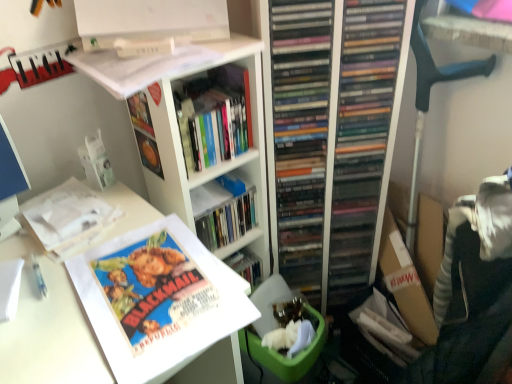
Question: Considering the relative sizes of white matte bookshelf at upper center and white paper at upper left, which appears as the 2th book when ordered from the bottom, in the image provided, is white matte bookshelf at upper center taller than white paper at upper left, which appears as the 2th book when ordered from the bottom,?

Choices:
 (A) yes
 (B) no

Answer: (A)

Question: Are white matte bookshelf at upper center and white paper at upper left, which appears as the 2th book when ordered from the bottom, located far from each other?

Choices:
 (A) yes
 (B) no

Answer: (B)

Question: Is white paper at upper left, which appears as the 2th book when ordered from the bottom, at the back of white matte bookshelf at upper center?

Choices:
 (A) no
 (B) yes

Answer: (A)

Question: From a real-world perspective, is white matte bookshelf at upper center located beneath white paper at upper left, acting as the 2th book starting from the top?

Choices:
 (A) yes
 (B) no

Answer: (A)

Question: Is white matte bookshelf at upper center to the left of white paper at upper left, acting as the 2th book starting from the top, from the viewer's perspective?

Choices:
 (A) yes
 (B) no

Answer: (B)

Question: From a real-world perspective, is white matte bookshelf at upper center on top of white paper at upper left, acting as the 2th book starting from the top?

Choices:
 (A) yes
 (B) no

Answer: (B)

Question: Can you confirm if white paper at upper left, which appears as the 2th book when ordered from the bottom, is taller than matte paper poster at lower left, which appears as the third book when viewed from the top?

Choices:
 (A) yes
 (B) no

Answer: (A)

Question: Is white paper at upper left, which appears as the 2th book when ordered from the bottom, to the right of matte paper poster at lower left, placed as the 1th book when sorted from bottom to top, from the viewer's perspective?

Choices:
 (A) yes
 (B) no

Answer: (B)

Question: From a real-world perspective, is white paper at upper left, which appears as the 2th book when ordered from the bottom, over matte paper poster at lower left, placed as the 1th book when sorted from bottom to top?

Choices:
 (A) yes
 (B) no

Answer: (A)

Question: Are white paper at upper left, which appears as the 2th book when ordered from the bottom, and matte paper poster at lower left, which appears as the third book when viewed from the top, beside each other?

Choices:
 (A) no
 (B) yes

Answer: (A)

Question: Would you say matte paper poster at lower left, placed as the 1th book when sorted from bottom to top, is part of white paper at upper left, which appears as the 2th book when ordered from the bottom,'s contents?

Choices:
 (A) yes
 (B) no

Answer: (B)

Question: Considering the relative sizes of white paper at upper left, acting as the 2th book starting from the top, and matte paper poster at lower left, placed as the 1th book when sorted from bottom to top, in the image provided, is white paper at upper left, acting as the 2th book starting from the top, smaller than matte paper poster at lower left, placed as the 1th book when sorted from bottom to top,?

Choices:
 (A) yes
 (B) no

Answer: (A)

Question: From the image's perspective, does black plastic computer chair at right appear lower than hardcover book at center, placed as the third book when sorted from bottom to top?

Choices:
 (A) no
 (B) yes

Answer: (B)